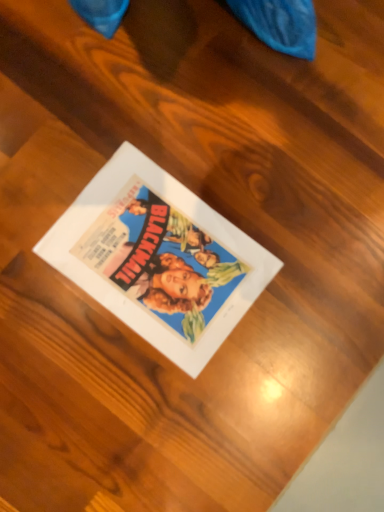
Image resolution: width=384 pixels, height=512 pixels. In order to click on vacant area on the back side of matte paper poster at center in this screenshot , I will do `click(208, 123)`.